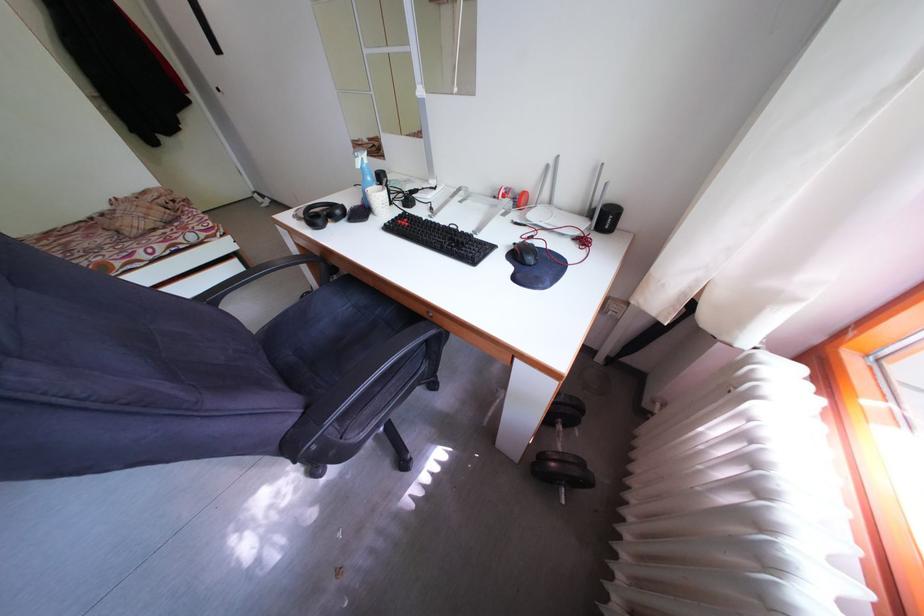
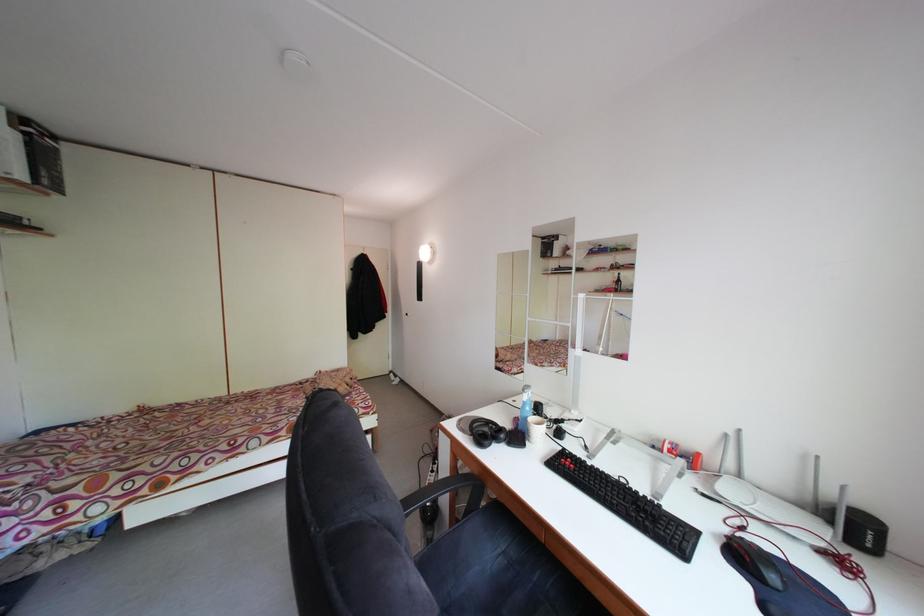
The images are taken continuously from a first-person perspective. In which direction is your viewpoint rotating?

The camera rotated toward left-up.